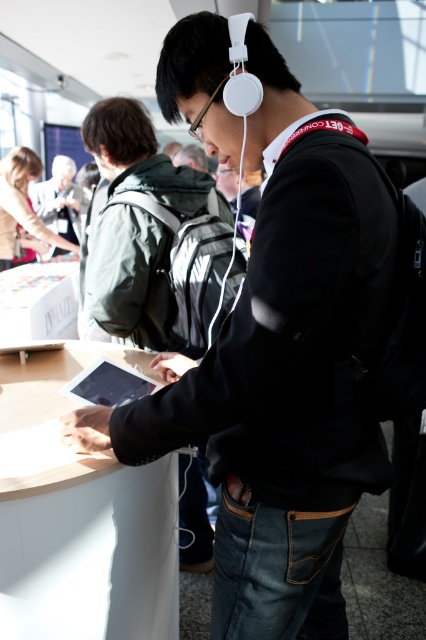
You are at the tech exhibition and want to know which of the two points, point (108, 508) or point (69, 228), is closer to you. Can you determine this based on the scene?

Point (108, 508) is closer to the viewer than point (69, 228), so yes, you can determine that point (108, 508) is closer to you.

You are at the tech event and need to place a new device on the white cardboard box at lower left. Where exactly should you place it according to the coordinates provided?

The white cardboard box at lower left is located at point (39, 301), so you should place the new device there.